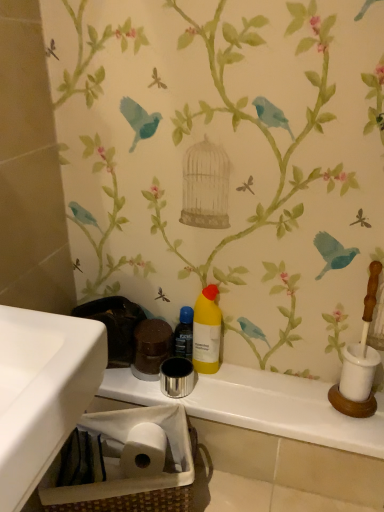
This screenshot has height=512, width=384. Identify the location of yellow matte bottle at center. (206, 332).

What are the coordinates of `woven brown basket at lower left` in the screenshot? It's located at (123, 463).

The height and width of the screenshot is (512, 384). What do you see at coordinates (123, 463) in the screenshot?
I see `woven brown basket at lower left` at bounding box center [123, 463].

Locate an element on the screen. This screenshot has width=384, height=512. metallic silver cup at center is located at coordinates coord(261,406).

You are a GUI agent. You are given a task and a screenshot of the screen. Output one action in this format:
    pyautogui.click(x=<x>, y=<y>)
    Task: Click on the yellow matte bottle at center
    The height and width of the screenshot is (512, 384).
    Given the screenshot: What is the action you would take?
    pyautogui.click(x=206, y=332)

Can you confirm if translucent plastic bottle at center is bigger than yellow matte bottle at center?

Incorrect, translucent plastic bottle at center is not larger than yellow matte bottle at center.

Considering the sizes of objects translucent plastic bottle at center and yellow matte bottle at center in the image provided, who is shorter, translucent plastic bottle at center or yellow matte bottle at center?

translucent plastic bottle at center.

How many degrees apart are the facing directions of yellow matte bottle at center and metallic silver cup at center?

0.597 degrees separate the facing orientations of yellow matte bottle at center and metallic silver cup at center.

Is yellow matte bottle at center taller than metallic silver cup at center?

Indeed, yellow matte bottle at center has a greater height compared to metallic silver cup at center.

From the image's perspective, is yellow matte bottle at center positioned above or below metallic silver cup at center?

From the image's perspective, yellow matte bottle at center appears above metallic silver cup at center.

Does yellow matte bottle at center turn towards metallic silver cup at center?

No, yellow matte bottle at center does not turn towards metallic silver cup at center.

Is woven brown basket at lower left facing away from yellow matte bottle at center?

No, yellow matte bottle at center is not at the back of woven brown basket at lower left.

The height and width of the screenshot is (512, 384). Find the location of `basket beneath the yellow matte bottle at center (from a real-world perspective)`. basket beneath the yellow matte bottle at center (from a real-world perspective) is located at coordinates (123, 463).

From the image's perspective, between woven brown basket at lower left and yellow matte bottle at center, which one is located above?

yellow matte bottle at center, from the image's perspective.

Which is behind, point (111, 424) or point (217, 353)?

Point (217, 353)

Which of these two, metallic silver cup at center or translucent plastic bottle at center, stands taller?

translucent plastic bottle at center is taller.

Is metallic silver cup at center looking in the opposite direction of translucent plastic bottle at center?

No, metallic silver cup at center is not facing the opposite direction of translucent plastic bottle at center.

Who is bigger, metallic silver cup at center or translucent plastic bottle at center?

metallic silver cup at center.

Is metallic silver cup at center to the right of translucent plastic bottle at center from the viewer's perspective?

Indeed, metallic silver cup at center is positioned on the right side of translucent plastic bottle at center.

In the scene shown: Is metallic silver cup at center oriented towards yellow matte bottle at center?

No, metallic silver cup at center does not turn towards yellow matte bottle at center.

How far apart are metallic silver cup at center and yellow matte bottle at center?

metallic silver cup at center is 8.30 inches away from yellow matte bottle at center.

Is metallic silver cup at center far away from yellow matte bottle at center?

Actually, metallic silver cup at center and yellow matte bottle at center are a little close together.

Can you tell me how much metallic silver cup at center and yellow matte bottle at center differ in facing direction?

The angle between the facing direction of metallic silver cup at center and the facing direction of yellow matte bottle at center is 0.597 degrees.

From a real-world perspective, is yellow matte bottle at center above or below woven brown basket at lower left?

yellow matte bottle at center is situated higher than woven brown basket at lower left in the real world.

Considering the positions of point (196, 333) and point (147, 482), is point (196, 333) closer or farther from the camera than point (147, 482)?

Point (196, 333) appears to be farther away from the viewer than point (147, 482).

Based on the photo, between yellow matte bottle at center and woven brown basket at lower left, which one has less height?

woven brown basket at lower left is shorter.

Looking at this image, which object is thinner, yellow matte bottle at center or woven brown basket at lower left?

yellow matte bottle at center is thinner.

From the picture: From a real-world perspective, does translucent plastic bottle at center stand above metallic silver cup at center?

Indeed, from a real-world perspective, translucent plastic bottle at center stands above metallic silver cup at center.

Which is correct: translucent plastic bottle at center is inside metallic silver cup at center, or outside of it?

translucent plastic bottle at center cannot be found inside metallic silver cup at center.

From the picture: Could you tell me if translucent plastic bottle at center is facing metallic silver cup at center?

No, translucent plastic bottle at center is not aimed at metallic silver cup at center.

Considering the relative sizes of translucent plastic bottle at center and metallic silver cup at center in the image provided, is translucent plastic bottle at center bigger than metallic silver cup at center?

Incorrect, translucent plastic bottle at center is not larger than metallic silver cup at center.

Where is `cleaning product in front of the translucent plastic bottle at center`? This screenshot has width=384, height=512. cleaning product in front of the translucent plastic bottle at center is located at coordinates (206, 332).

Find the location of a particular element. The height and width of the screenshot is (512, 384). cleaning product above the metallic silver cup at center (from the image's perspective) is located at coordinates [206, 332].

Based on their spatial positions, is metallic silver cup at center or woven brown basket at lower left closer to translucent plastic bottle at center?

metallic silver cup at center is closer to translucent plastic bottle at center.

From the image, which object appears to be nearer to yellow matte bottle at center, translucent plastic bottle at center or woven brown basket at lower left?

translucent plastic bottle at center is closer to yellow matte bottle at center.

Considering their positions, is yellow matte bottle at center positioned further to translucent plastic bottle at center than woven brown basket at lower left?

woven brown basket at lower left.

When comparing their distances from metallic silver cup at center, does translucent plastic bottle at center or woven brown basket at lower left seem further?

translucent plastic bottle at center is further to metallic silver cup at center.

When comparing their distances from woven brown basket at lower left, does metallic silver cup at center or translucent plastic bottle at center seem further?

Among the two, translucent plastic bottle at center is located further to woven brown basket at lower left.

Which object lies nearer to the anchor point metallic silver cup at center, woven brown basket at lower left or yellow matte bottle at center?

woven brown basket at lower left lies closer to metallic silver cup at center than the other object.

Considering their positions, is translucent plastic bottle at center positioned further to yellow matte bottle at center than metallic silver cup at center?

metallic silver cup at center.

Looking at the image, which one is located closer to translucent plastic bottle at center, woven brown basket at lower left or yellow matte bottle at center?

yellow matte bottle at center is positioned closer to the anchor translucent plastic bottle at center.

At what (x,y) coordinates should I click in order to perform the action: click on counter top between translucent plastic bottle at center and woven brown basket at lower left in the vertical direction. Please return your answer as a coordinate pair (x, y). This screenshot has height=512, width=384. Looking at the image, I should click on (261, 406).

Where is `bottle between yellow matte bottle at center and woven brown basket at lower left vertically`? Image resolution: width=384 pixels, height=512 pixels. bottle between yellow matte bottle at center and woven brown basket at lower left vertically is located at coordinates (184, 334).

Image resolution: width=384 pixels, height=512 pixels. What are the coordinates of `counter top between yellow matte bottle at center and woven brown basket at lower left in the vertical direction` in the screenshot? It's located at (261, 406).

You are a GUI agent. You are given a task and a screenshot of the screen. Output one action in this format:
    pyautogui.click(x=<x>, y=<y>)
    Task: Click on the bottle between yellow matte bottle at center and metallic silver cup at center vertically
    Image resolution: width=384 pixels, height=512 pixels.
    Given the screenshot: What is the action you would take?
    pyautogui.click(x=184, y=334)